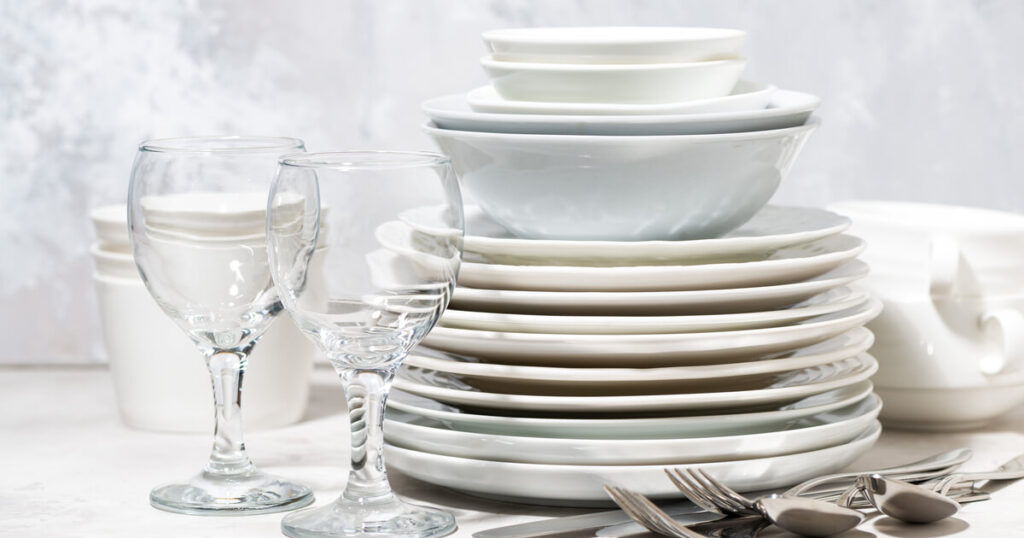
Identify the location of bowls. (635, 47), (646, 70), (646, 107), (651, 122), (640, 175).